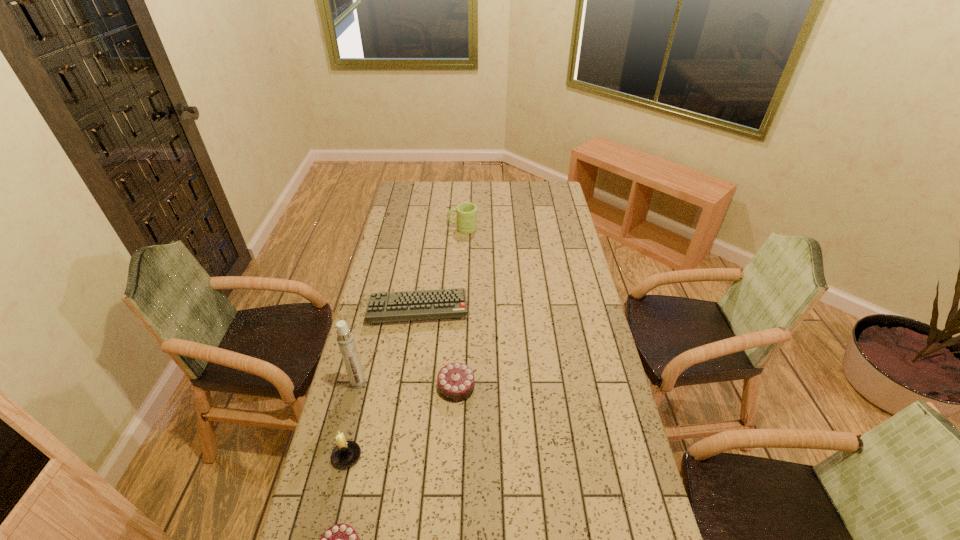
Please show where to add a chocolate cake on the right while keeping spacing even. Please provide its 2D coordinates. Your answer should be formatted as a tuple, i.e. [(x, y)], where the tuple contains the x and y coordinates of a point satisfying the conditions above.

[(525, 289)]